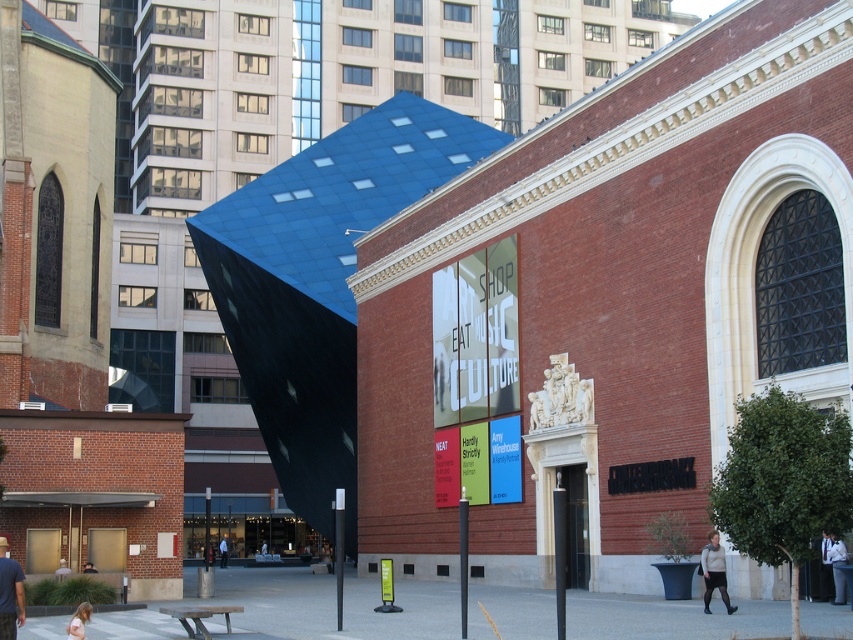
Is point (706, 598) positioned before point (824, 598)?

That is True.

Find the location of a particular element. This screenshot has height=640, width=853. light gray sweater at lower right is located at coordinates (714, 572).

Locate an element on the screen. The width and height of the screenshot is (853, 640). light gray sweater at lower right is located at coordinates (714, 572).

Who is more forward, (x=535, y=417) or (x=219, y=550)?

Positioned in front is point (x=535, y=417).

Image resolution: width=853 pixels, height=640 pixels. Identify the location of white marble sculpture at center. (560, 396).

Where is `white marble sculpture at center`? white marble sculpture at center is located at coordinates (560, 396).

Based on the photo, who is more distant from viewer, (225, 550) or (55, 573)?

The point (225, 550) is behind.

How distant is white shirt at center from light brown wooden bench at lower left?

white shirt at center and light brown wooden bench at lower left are 54.57 meters apart.

Locate an element on the screen. white shirt at center is located at coordinates (223, 550).